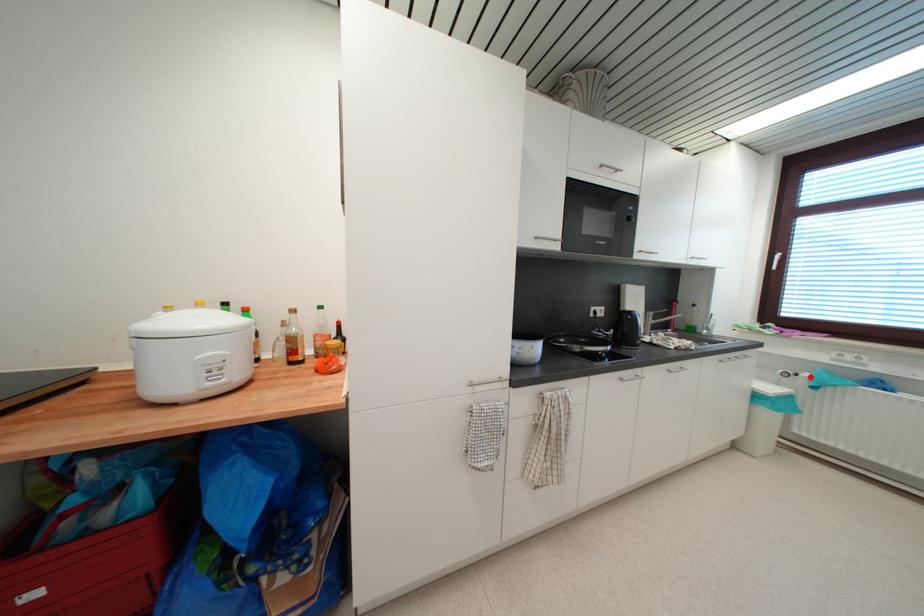
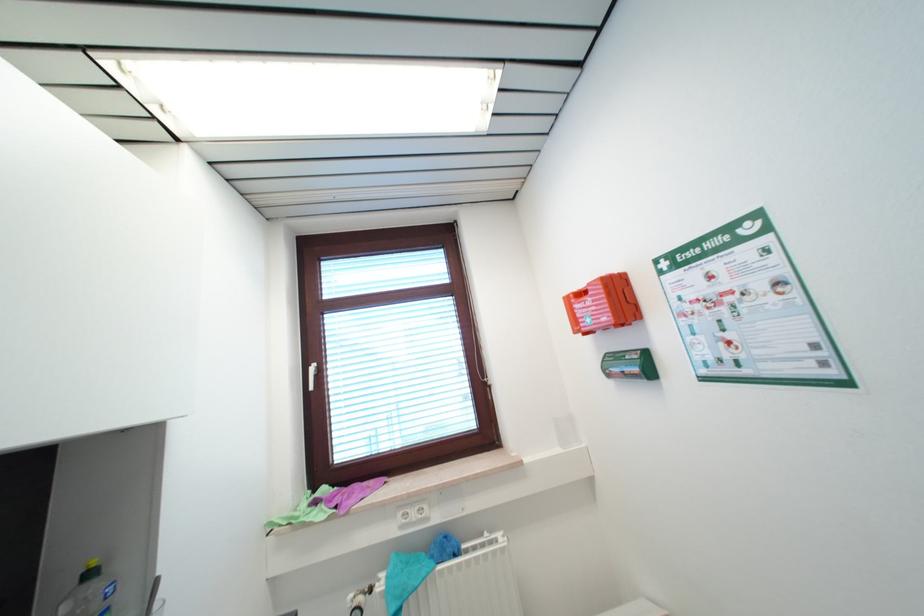
The point at the highlighted location is marked in the first image. Where is the corresponding point in the second image?

(385, 589)